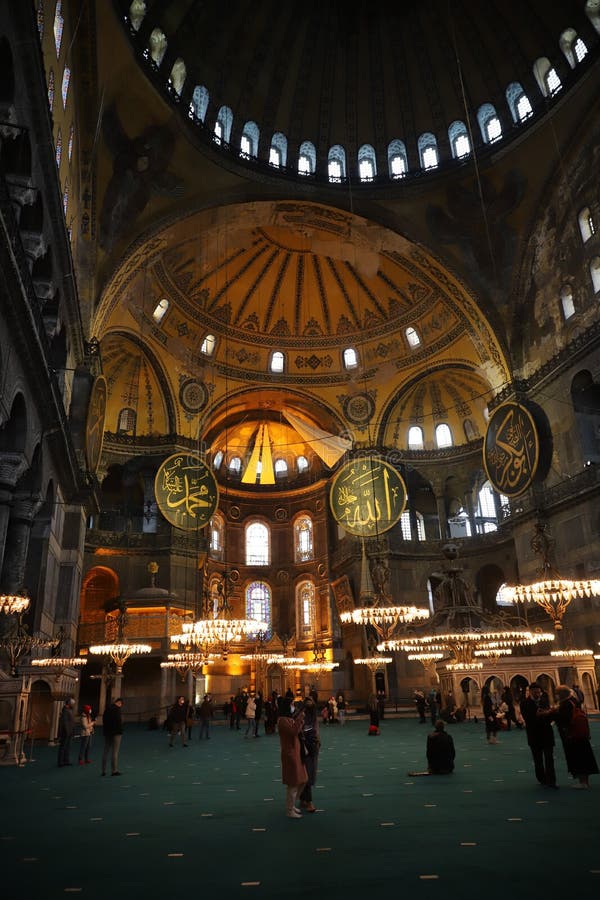
Find the location of a particular element. windows of building is located at coordinates (273, 153), (243, 137), (303, 159), (257, 607), (259, 536), (301, 543), (406, 523), (489, 508).